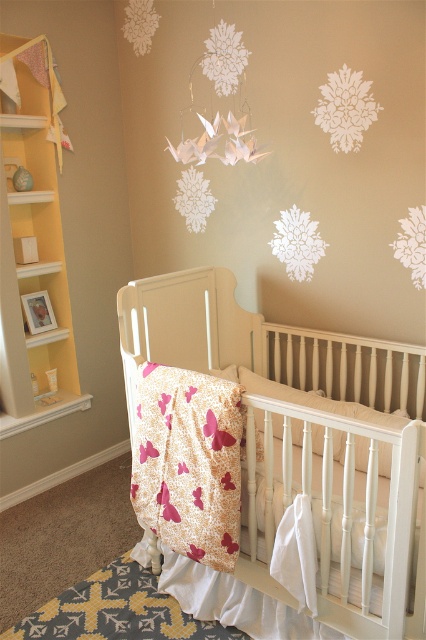
You are a parent entering the nursery and want to place a new toy on the shelf closest to the entrance. Based on the scene, which object should you approach first, the white wood crib at center or the yellow wood bookshelf at left?

The yellow wood bookshelf at left is to the left of the white wood crib at center, so you should approach the yellow wood bookshelf at left first as it is closer to the entrance.

You are a parent trying to place a new nightlight in the nursery. The nightlight requires a spot on the wall that is not directly above or below the white wood crib at center. Based on the nursery layout, where should you place the nightlight?

The white wood crib at center is located at coordinates (319, 525). To avoid placing the nightlight directly above or below it, choose a position on the wall that is either to the left or right of these coordinates.

You are a parent setting up the nursery. You want to place a small nightlight on the highest object in the room. Which object should you choose between the white wood crib at center and the white soft pillow at center?

The white wood crib at center is taller than the white soft pillow at center, so you should place the nightlight on the white wood crib at center.